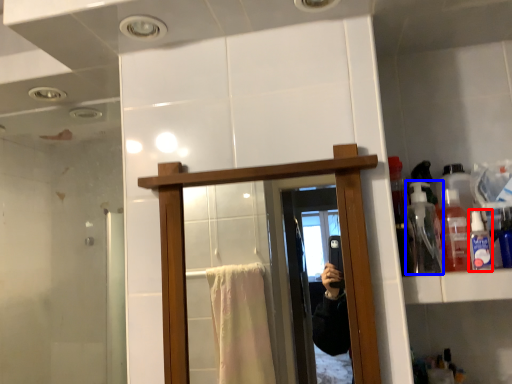
Question: Which of the following is the closest to the observer, toiletry (highlighted by a red box) or bottle (highlighted by a blue box)?

Choices:
 (A) toiletry
 (B) bottle

Answer: (A)